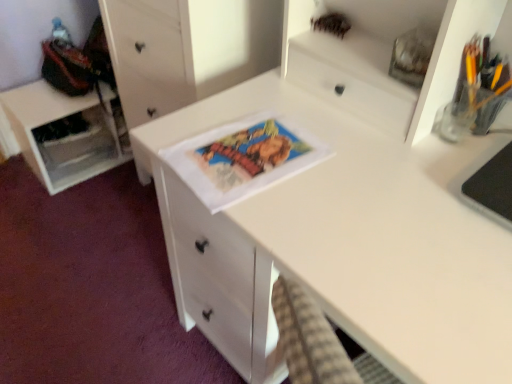
Identify the location of white matte desk at center. This screenshot has width=512, height=384. (345, 244).

Describe the element at coordinates (483, 82) in the screenshot. I see `translucent glass pencil holder at upper right` at that location.

This screenshot has height=384, width=512. Find the location of `matte paper comic book at center`. matte paper comic book at center is located at coordinates (243, 158).

Considering the sizes of objects white matte desk at center and translucent glass pencil holder at upper right in the image provided, who is wider, white matte desk at center or translucent glass pencil holder at upper right?

white matte desk at center is wider.

Does white matte desk at center contain translucent glass pencil holder at upper right?

No, white matte desk at center does not contain translucent glass pencil holder at upper right.

From the image's perspective, is white matte desk at center under translucent glass pencil holder at upper right?

Yes, from the image's perspective, white matte desk at center is beneath translucent glass pencil holder at upper right.

Can you see white matte desk at center touching translucent glass pencil holder at upper right?

No.

Locate an element on the screen. The width and height of the screenshot is (512, 384). comic book below the white matte chest of drawers at center (from the image's perspective) is located at coordinates (243, 158).

Considering the relative positions of white matte chest of drawers at center and matte paper comic book at center in the image provided, is white matte chest of drawers at center to the left of matte paper comic book at center from the viewer's perspective?

Yes.

From the image's perspective, which is above, white matte chest of drawers at center or matte paper comic book at center?

white matte chest of drawers at center, from the image's perspective.

Where is `cabinetry behind the white matte desk at center`? The image size is (512, 384). cabinetry behind the white matte desk at center is located at coordinates (64, 137).

In the scene shown: In terms of height, does white matte cabinet at left look taller or shorter compared to white matte desk at center?

Clearly, white matte cabinet at left is shorter compared to white matte desk at center.

Considering the sizes of objects white matte cabinet at left and white matte desk at center in the image provided, who is smaller, white matte cabinet at left or white matte desk at center?

Smaller between the two is white matte cabinet at left.

Visually, is white matte chest of drawers at center positioned to the left or to the right of white matte desk at center?

In the image, white matte chest of drawers at center appears on the left side of white matte desk at center.

Based on the photo, which is closer, (138, 85) or (487, 344)?

Point (138, 85) is farther from the camera than point (487, 344).

Is white matte chest of drawers at center taller or shorter than white matte desk at center?

In the image, white matte chest of drawers at center appears to be taller than white matte desk at center.

How many degrees apart are the facing directions of white matte cabinet at left and translucent glass pencil holder at upper right?

90.2 degrees.

Consider the image. Can you confirm if white matte cabinet at left is positioned to the right of translucent glass pencil holder at upper right?

No, white matte cabinet at left is not to the right of translucent glass pencil holder at upper right.

Do you think white matte cabinet at left is within translucent glass pencil holder at upper right, or outside of it?

white matte cabinet at left is spatially situated outside translucent glass pencil holder at upper right.

Considering the sizes of objects white matte cabinet at left and translucent glass pencil holder at upper right in the image provided, who is shorter, white matte cabinet at left or translucent glass pencil holder at upper right?

translucent glass pencil holder at upper right is shorter.

From the image's perspective, which is above, translucent glass pencil holder at upper right or matte paper comic book at center?

From the image's view, translucent glass pencil holder at upper right is above.

Is the position of translucent glass pencil holder at upper right less distant than that of matte paper comic book at center?

Yes, it is in front of matte paper comic book at center.

Is translucent glass pencil holder at upper right taller than matte paper comic book at center?

Yes.

The height and width of the screenshot is (384, 512). I want to click on comic book behind the white matte desk at center, so click(x=243, y=158).

Considering the sizes of objects white matte desk at center and matte paper comic book at center in the image provided, who is taller, white matte desk at center or matte paper comic book at center?

Standing taller between the two is white matte desk at center.

In the scene shown: Is white matte desk at center aimed at matte paper comic book at center?

No, white matte desk at center is not aimed at matte paper comic book at center.

Looking at their sizes, would you say white matte desk at center is wider or thinner than matte paper comic book at center?

In the image, white matte desk at center appears to be wider than matte paper comic book at center.

This screenshot has width=512, height=384. Identify the location of stationery located above the white matte desk at center (from the image's perspective). (483, 82).

What are the coordinates of `comic book that appears below the white matte chest of drawers at center (from the image's perspective)` in the screenshot? It's located at (243, 158).

Based on their spatial positions, is matte paper comic book at center or translucent glass pencil holder at upper right further from white matte desk at center?

Among the two, translucent glass pencil holder at upper right is located further to white matte desk at center.

Considering their positions, is matte paper comic book at center positioned further to white matte desk at center than white matte chest of drawers at center?

The object further to white matte desk at center is white matte chest of drawers at center.

When comparing their distances from translucent glass pencil holder at upper right, does white matte desk at center or white matte chest of drawers at center seem closer?

Among the two, white matte desk at center is located nearer to translucent glass pencil holder at upper right.

Estimate the real-world distances between objects in this image. Which object is closer to translucent glass pencil holder at upper right, white matte desk at center or matte paper comic book at center?

matte paper comic book at center is closer to translucent glass pencil holder at upper right.

When comparing their distances from white matte desk at center, does white matte chest of drawers at center or matte paper comic book at center seem further?

white matte chest of drawers at center.

From the image, which object appears to be farther from matte paper comic book at center, white matte desk at center or white matte cabinet at left?

Based on the image, white matte cabinet at left appears to be further to matte paper comic book at center.

From the image, which object appears to be farther from white matte desk at center, matte paper comic book at center or white matte cabinet at left?

Based on the image, white matte cabinet at left appears to be further to white matte desk at center.

Which object lies further to the anchor point white matte chest of drawers at center, white matte cabinet at left or matte paper comic book at center?

Based on the image, white matte cabinet at left appears to be further to white matte chest of drawers at center.

Where is `comic book located between white matte desk at center and white matte cabinet at left in the depth direction`? The height and width of the screenshot is (384, 512). comic book located between white matte desk at center and white matte cabinet at left in the depth direction is located at coordinates (243, 158).

Find the location of `stationery between white matte chest of drawers at center and white matte desk at center vertically`. stationery between white matte chest of drawers at center and white matte desk at center vertically is located at coordinates (483, 82).

Locate an element on the screen. comic book between white matte chest of drawers at center and white matte desk at center vertically is located at coordinates (243, 158).

Identify the location of desk between white matte cabinet at left and translucent glass pencil holder at upper right in the horizontal direction. (345, 244).